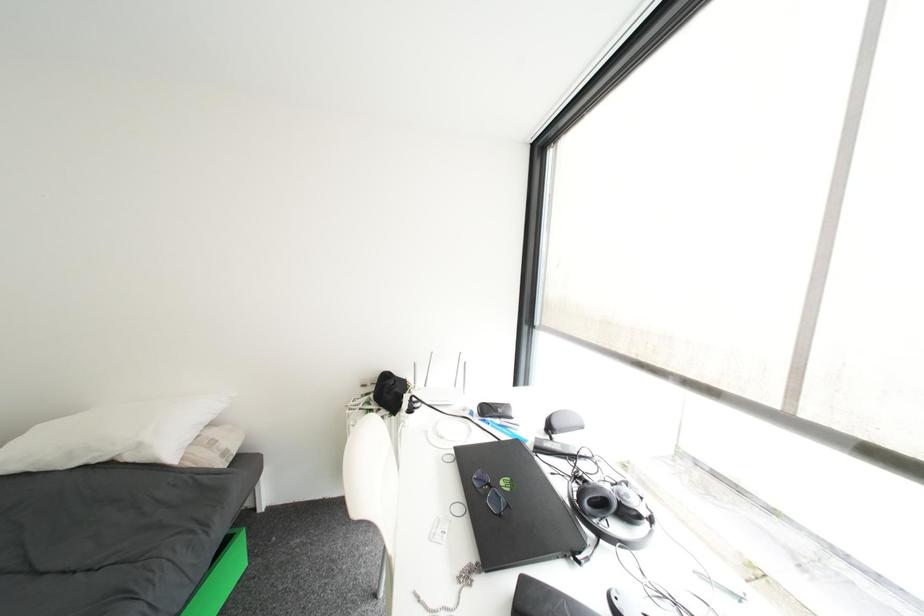
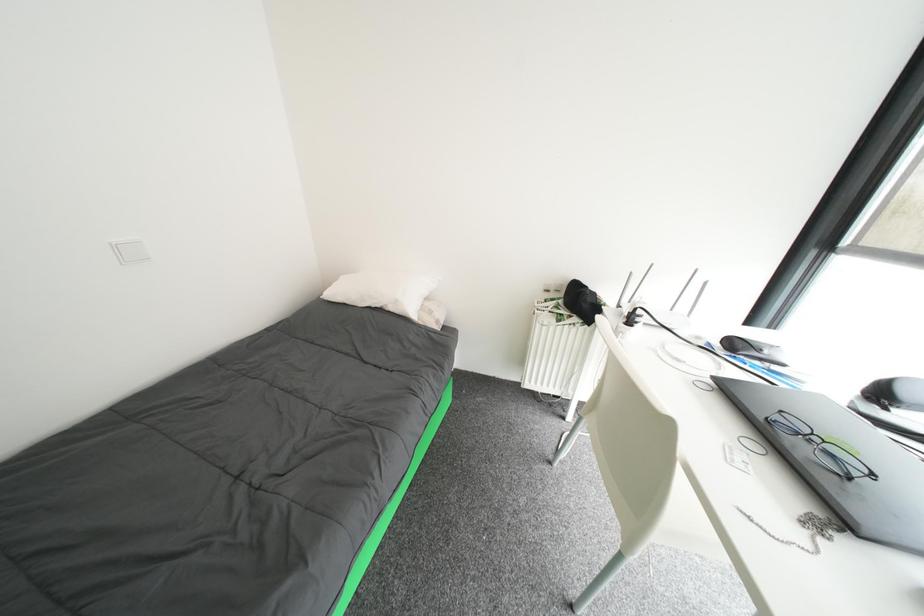
The first image is from the beginning of the video and the second image is from the end. How did the camera likely rotate when shooting the video?

The camera rotated toward left-down.